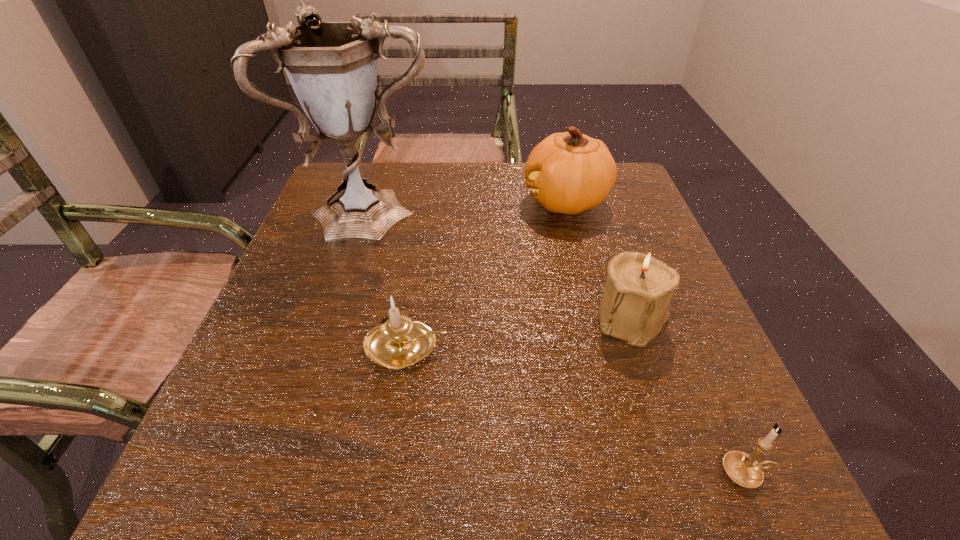
Image resolution: width=960 pixels, height=540 pixels. In order to click on free spot between the tallest candle holder and the leftmost candle holder in this screenshot , I will do `click(519, 333)`.

Where is `free space between the tallest object and the leftmost candle holder`? This screenshot has width=960, height=540. free space between the tallest object and the leftmost candle holder is located at coordinates (391, 280).

Locate an element on the screen. Image resolution: width=960 pixels, height=540 pixels. empty space between the trophy cup and the nearest candle holder is located at coordinates (561, 342).

What are the coordinates of `unoccupied position between the trophy cup and the leftmost candle holder` in the screenshot? It's located at (391, 280).

Where is `vacant space that's between the nearest candle holder and the leftmost candle holder`? vacant space that's between the nearest candle holder and the leftmost candle holder is located at coordinates (576, 409).

Select which object appears as the third closest to the pumpkin. Please provide its 2D coordinates. Your answer should be formatted as a tuple, i.e. [(x, y)], where the tuple contains the x and y coordinates of a point satisfying the conditions above.

[(398, 342)]

Where is `object that can be found as the second closest to the pumpkin`? The image size is (960, 540). object that can be found as the second closest to the pumpkin is located at coordinates (634, 307).

Select which candle holder is the second closest to the tallest candle holder. Please provide its 2D coordinates. Your answer should be formatted as a tuple, i.e. [(x, y)], where the tuple contains the x and y coordinates of a point satisfying the conditions above.

[(398, 342)]

Locate an element on the screen. candle holder that is the second closest to the pumpkin is located at coordinates (398, 342).

Where is `vacant space that satisfies the following two spatial constraints: 1. on the front face of the second tallest object; 2. on the right side of the tallest candle holder`? vacant space that satisfies the following two spatial constraints: 1. on the front face of the second tallest object; 2. on the right side of the tallest candle holder is located at coordinates (595, 319).